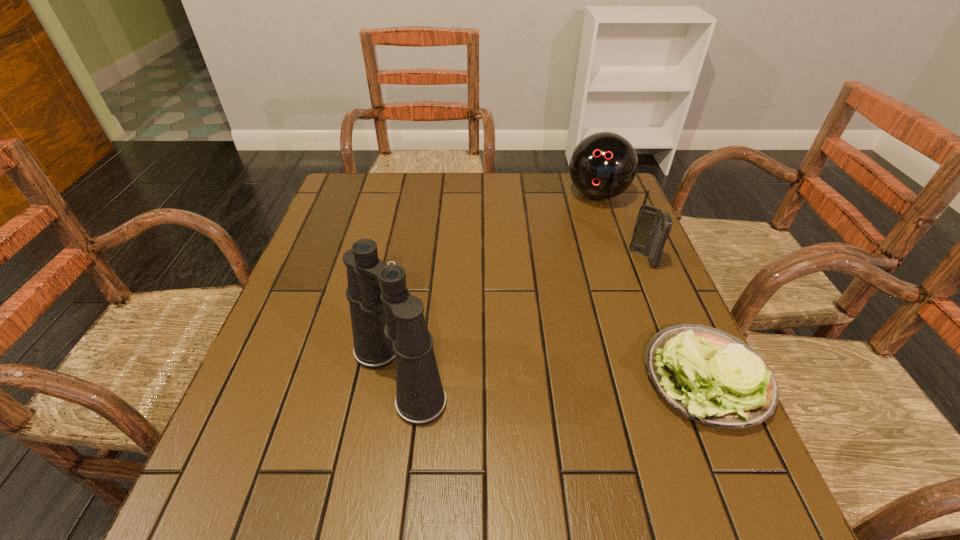
Where is `binoculars`? The height and width of the screenshot is (540, 960). binoculars is located at coordinates (388, 323).

Where is `the tallest object`? the tallest object is located at coordinates (388, 323).

Where is `lettuce`? The height and width of the screenshot is (540, 960). lettuce is located at coordinates (712, 377).

Where is `the second farthest object`? the second farthest object is located at coordinates (653, 227).

Where is `the farthest object`? the farthest object is located at coordinates (603, 165).

Locate an element on the screen. free space located 0.330m on the back of the binoculars is located at coordinates (420, 239).

This screenshot has width=960, height=540. What are the coordinates of `free location located on the left of the shortest object` in the screenshot? It's located at (455, 378).

In order to click on free location located on the keyboard of the cellular telephone in this screenshot , I will do `click(624, 297)`.

Where is `free space located 0.380m on the keyboard of the cellular telephone`? free space located 0.380m on the keyboard of the cellular telephone is located at coordinates (580, 377).

Image resolution: width=960 pixels, height=540 pixels. I want to click on free space located on the keyboard of the cellular telephone, so click(x=627, y=292).